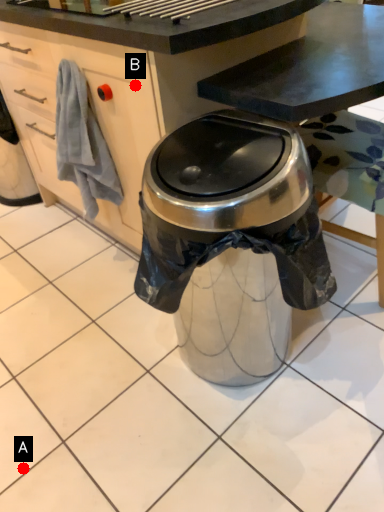
Question: Two points are circled on the image, labeled by A and B beside each circle. Which of the following is the farthest from the observer?

Choices:
 (A) A is further
 (B) B is further

Answer: (A)